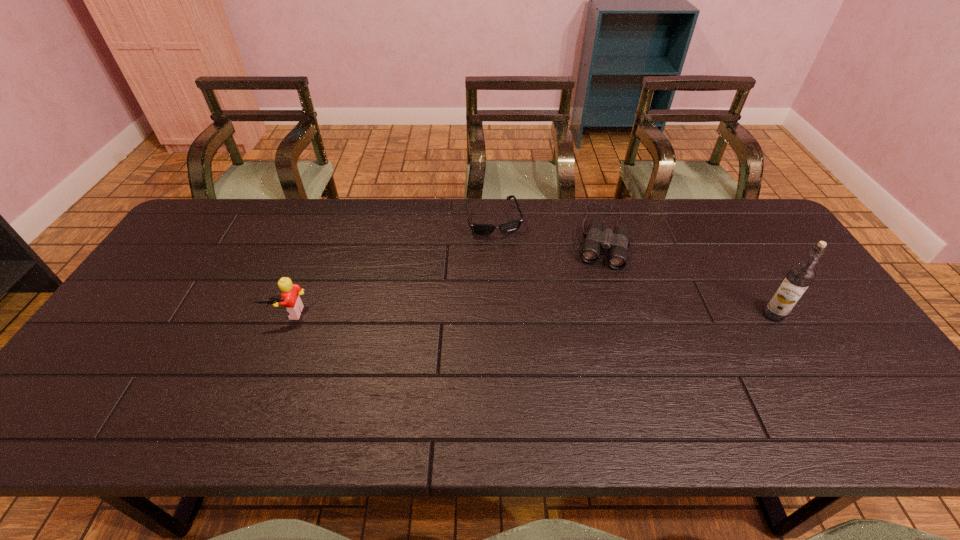
Where is `vacant space at the left edge of the desktop`? vacant space at the left edge of the desktop is located at coordinates (150, 301).

Image resolution: width=960 pixels, height=540 pixels. I want to click on vacant space at the far left corner of the desktop, so click(x=188, y=232).

This screenshot has height=540, width=960. Identify the location of vacant area at the far right corner of the desktop. (721, 199).

I want to click on vacant space at the near right corner of the desktop, so click(870, 397).

Locate an element on the screen. free area in between the second object from right to left and the leftmost object is located at coordinates (444, 274).

What are the coordinates of `vacant space in between the tallest object and the third shortest object` in the screenshot? It's located at tap(531, 314).

Identify the location of vacant area between the second object from left to right and the second tallest object. (391, 267).

The height and width of the screenshot is (540, 960). Identify the location of vacant area that lies between the second object from right to left and the vodka. (686, 275).

Where is `free space that is in between the third object from left to right and the third shortest object`? The height and width of the screenshot is (540, 960). free space that is in between the third object from left to right and the third shortest object is located at coordinates click(x=444, y=274).

I want to click on vacant space in between the sunglasses and the binoculars, so click(547, 228).